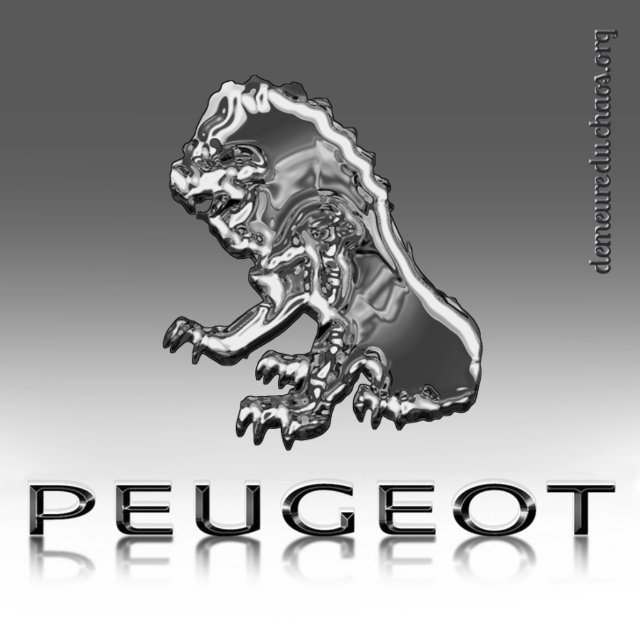
Who is lower down, shiny metallic lion at center or chrome metallic logo at center?

Positioned lower is chrome metallic logo at center.

Which is behind, point (305, 237) or point (388, 516)?

Point (388, 516)

Find the location of a particular element. The width and height of the screenshot is (640, 640). shiny metallic lion at center is located at coordinates (x=317, y=269).